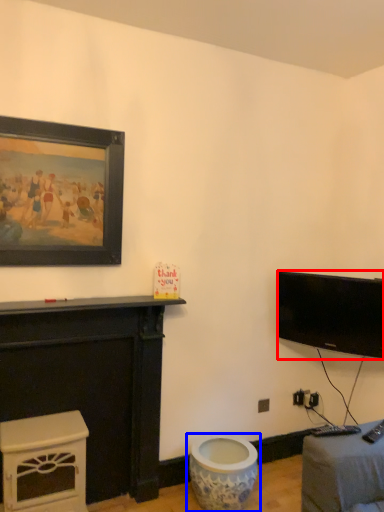
Question: Which of the following is the farthest to the observer, television (highlighted by a red box) or toilet (highlighted by a blue box)?

Choices:
 (A) television
 (B) toilet

Answer: (A)